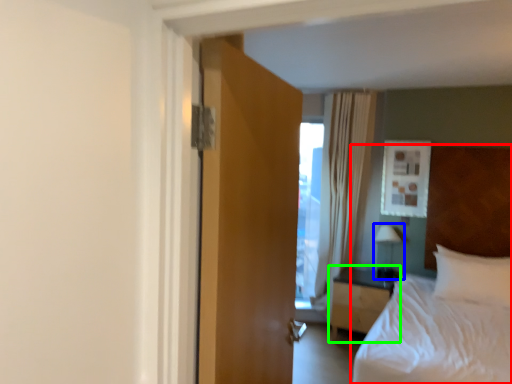
Question: Considering the real-world distances, which object is closest to bed (highlighted by a red box)? lamp (highlighted by a blue box) or nightstand (highlighted by a green box).

Choices:
 (A) lamp
 (B) nightstand

Answer: (B)